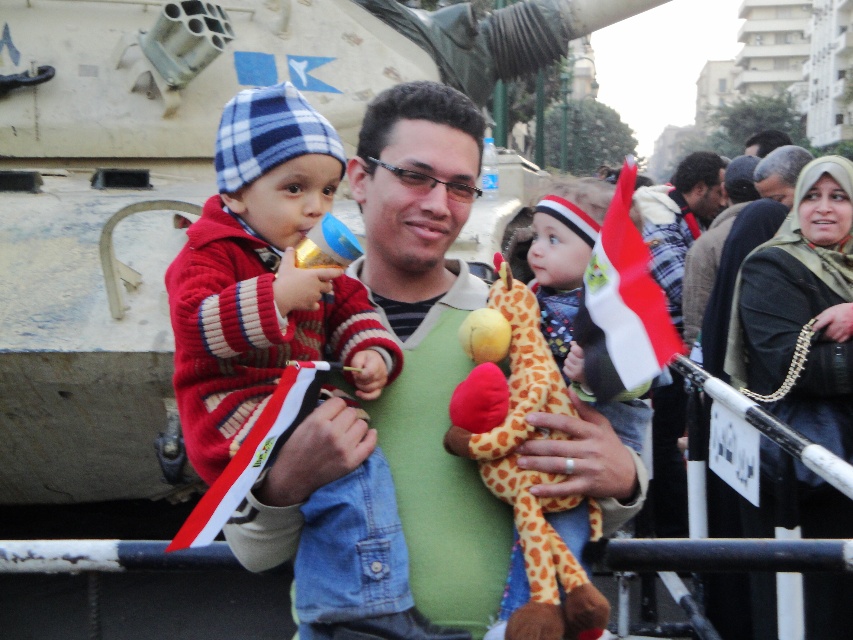
Looking at this image, does red and white striped sweater at center lie behind soft plush giraffe at center?

No.

Can you confirm if red and white striped sweater at center is smaller than soft plush giraffe at center?

No.

Is point (338, 157) positioned before point (482, 436)?

That is False.

Identify the location of red and white striped sweater at center. Image resolution: width=853 pixels, height=640 pixels. (263, 276).